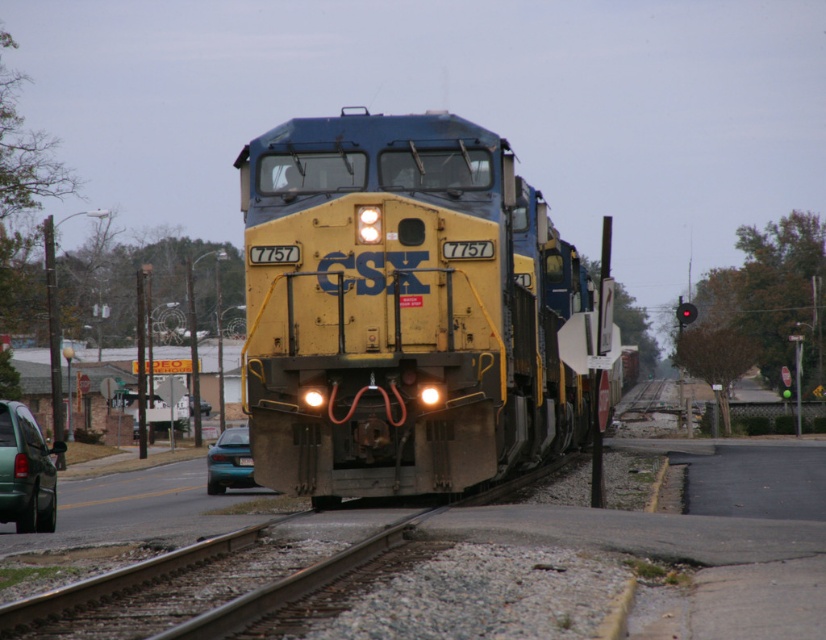
You are a delivery driver approaching a railway crossing. You see the yellow matte locomotive at center and the green matte van at lower left. Which vehicle is taller?

The yellow matte locomotive at center is taller than the green matte van at lower left.

You are a pedestrian standing at the crossing where the CSX locomotive 7757 is approaching. You see the green matte van at lower left. Can you safely cross the tracks before the train arrives?

The distance between you and the green matte van at lower left is 17.57 meters. Assuming the train is moving at a typical speed of 30 mph, you have enough time to cross the tracks safely before the train arrives.

You are a traffic controller monitoring the railway crossing. You notice the yellow matte locomotive at center near the stop and yield signs. Based on its position, can you confirm if the locomotive is currently on the tracks leading to the crossing?

The yellow matte locomotive at center is located at point coordinates that place it precisely at the crossing where the stop and yield signs are present. Therefore, it is indeed on the tracks leading to the crossing.